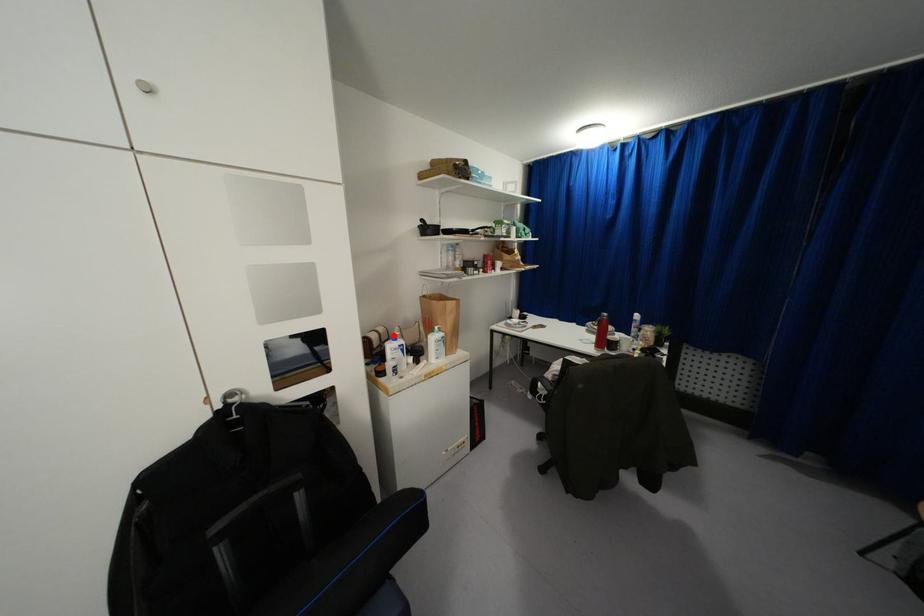
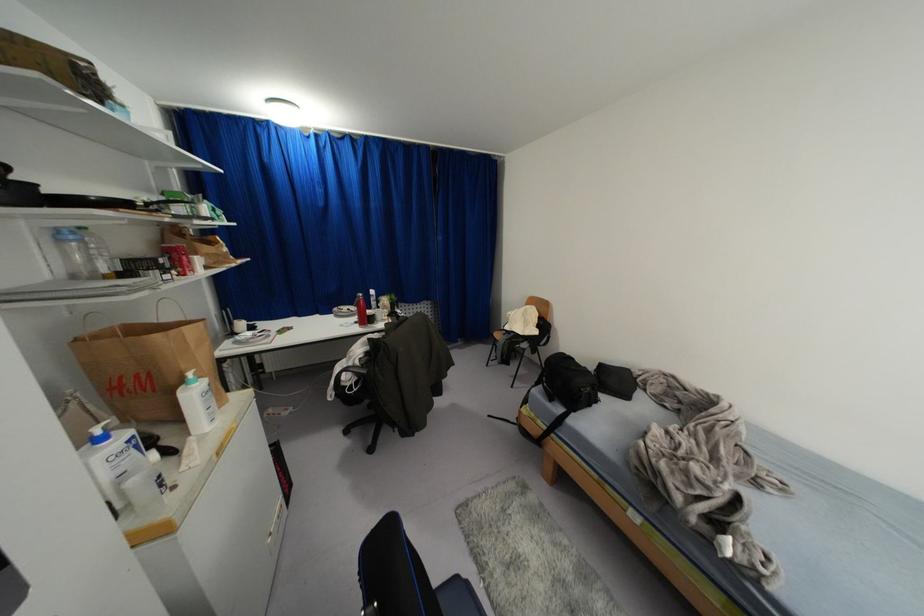
Locate, in the second image, the point that corresponds to the highlighted location in the first image.

(98, 431)